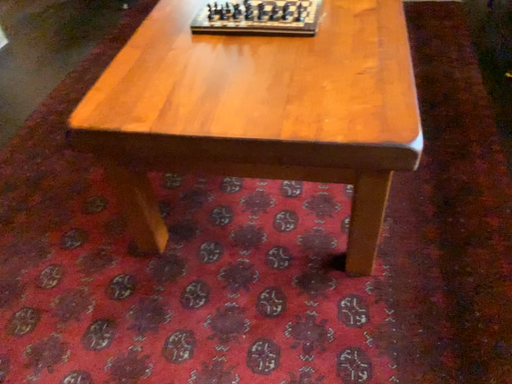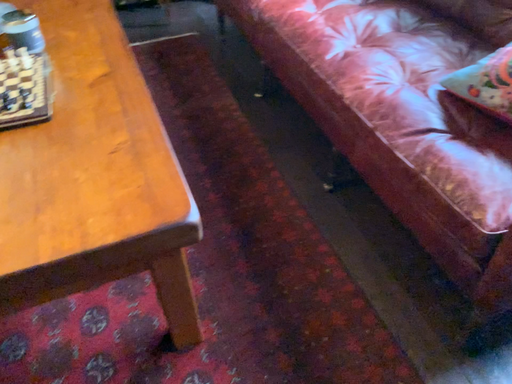
Question: Which way did the camera rotate in the video?

Choices:
 (A) rotated left
 (B) rotated right

Answer: (B)